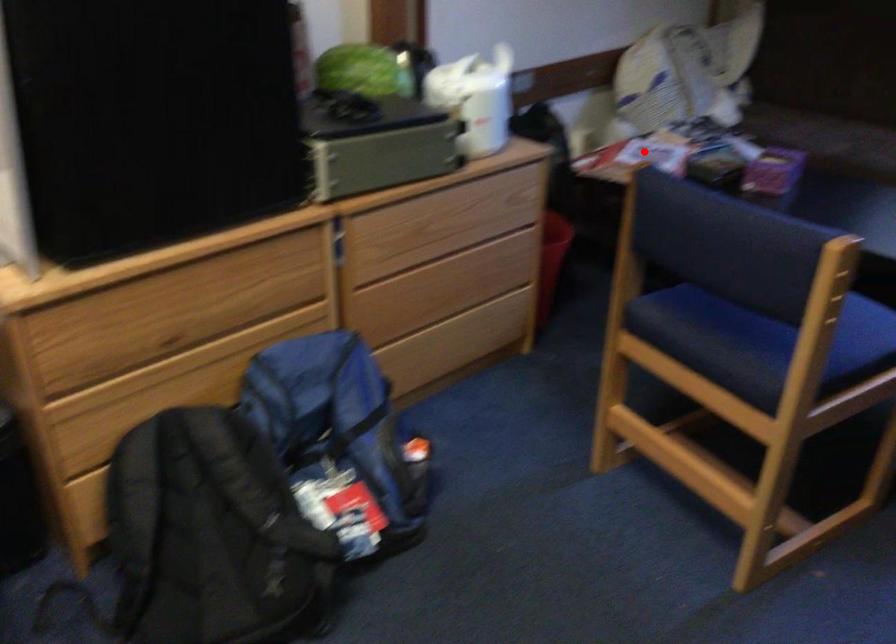
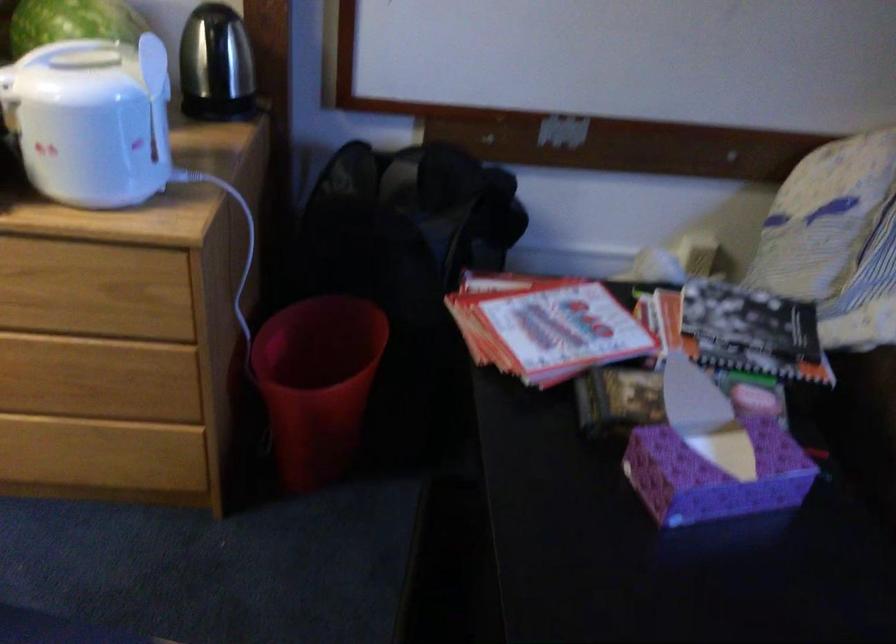
Question: I am providing you with two images of the same scene from different viewpoints. Image1 has a red point marked. In image2, the corresponding 3D location appears at what relative position? Reply with the corresponding letter.

Choices:
 (A) Closer
 (B) Farther

Answer: (A)